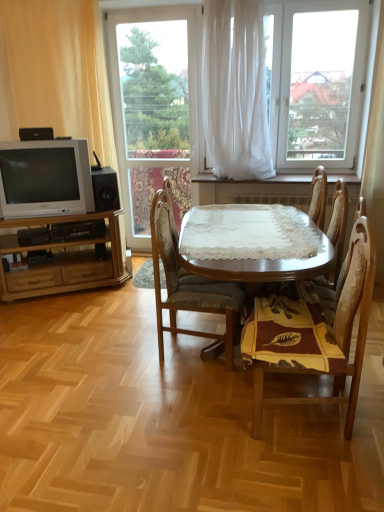
Locate an element on the screen. The height and width of the screenshot is (512, 384). vacant region under wooden chair at center, arranged as the 2th chair when viewed from the left (from a real-world perspective) is located at coordinates pos(298,425).